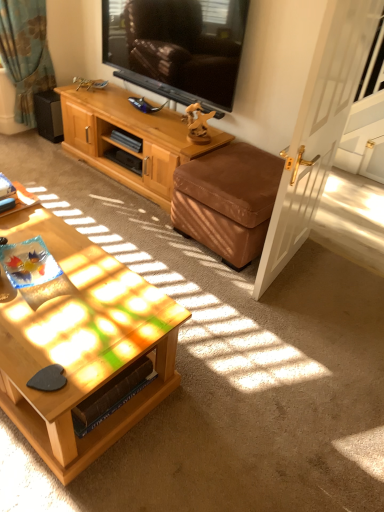
Question: Visually, is black matte speaker at left positioned to the left or to the right of wooden desk at lower left?

Choices:
 (A) right
 (B) left

Answer: (B)

Question: Is black matte speaker at left taller or shorter than wooden desk at lower left?

Choices:
 (A) short
 (B) tall

Answer: (B)

Question: Which of these objects is positioned closest to the brown leather ottoman at lower right?

Choices:
 (A) wooden desk at lower left
 (B) teal fabric curtain at upper left
 (C) light brown wood cabinet at upper center
 (D) black matte speaker at left
 (E) white glossy door at right

Answer: (E)

Question: Which object is the farthest from the black glossy television at upper center?

Choices:
 (A) brown leather ottoman at lower right
 (B) light brown wood cabinet at upper center
 (C) woodenobject at lower left
 (D) white glossy door at right
 (E) wooden desk at lower left

Answer: (C)